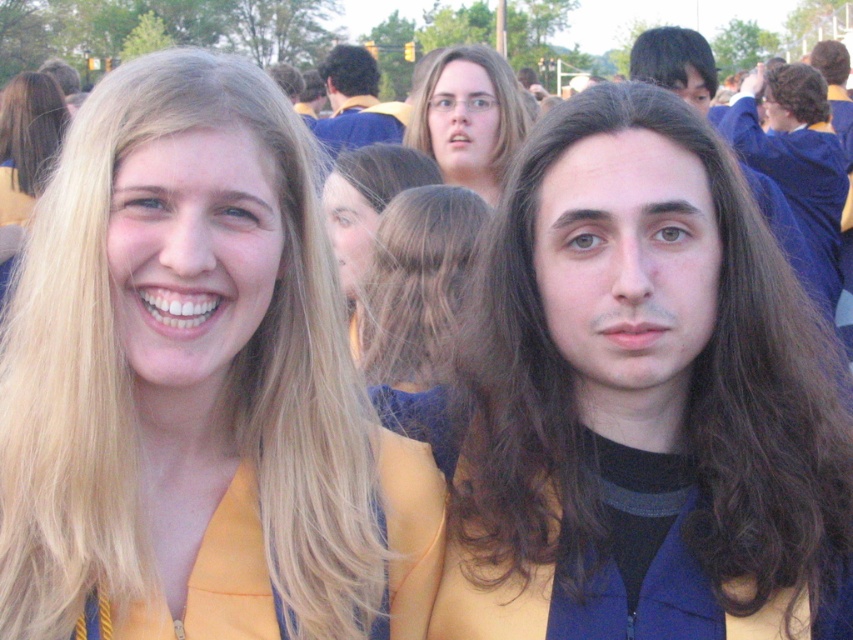
Question: Is blonde hair at center bigger than dark curly hair at upper center?

Choices:
 (A) no
 (B) yes

Answer: (A)

Question: Does matte yellow graduation gown at center have a larger size compared to dark curly hair at upper center?

Choices:
 (A) no
 (B) yes

Answer: (A)

Question: Does blonde hair at center appear over dark curly hair at upper center?

Choices:
 (A) no
 (B) yes

Answer: (A)

Question: Which object appears closest to the camera in this image?

Choices:
 (A) blonde hair at upper center
 (B) dark curly hair at upper center

Answer: (A)

Question: Which point is closer to the camera?

Choices:
 (A) dark curly hair at upper center
 (B) dark brown silky hair at center

Answer: (B)

Question: Which of these objects is positioned closest to the dark brown silky hair at center?

Choices:
 (A) matte yellow graduation gown at center
 (B) blonde hair at upper right
 (C) dark brown hair at upper right
 (D) dark curly hair at upper center

Answer: (A)